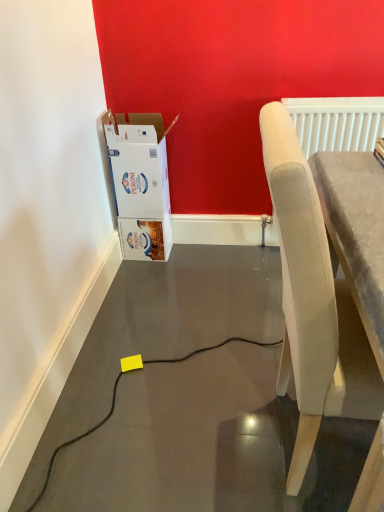
Describe the element at coordinates (313, 303) in the screenshot. I see `light gray fabric chair at right` at that location.

What do you see at coordinates (336, 123) in the screenshot? The height and width of the screenshot is (512, 384). I see `white textured radiator at upper right` at bounding box center [336, 123].

At what (x,y) coordinates should I click in order to perform the action: click on light gray fabric chair at right. Please return your answer as a coordinate pair (x, y). Looking at the image, I should click on (313, 303).

Considering the sizes of objects light gray fabric chair at right and white textured radiator at upper right in the image provided, who is bigger, light gray fabric chair at right or white textured radiator at upper right?

light gray fabric chair at right.

Identify the location of radiator above the light gray fabric chair at right (from the image's perspective). The image size is (384, 512). (336, 123).

Is light gray fabric chair at right at the left side of white textured radiator at upper right?

Yes.

What's the angular difference between light gray fabric chair at right and white textured radiator at upper right's facing directions?

There is a 90-degree angle between the facing directions of light gray fabric chair at right and white textured radiator at upper right.

Measure the distance from white cardboard box at left to white textured radiator at upper right.

white cardboard box at left and white textured radiator at upper right are 75.86 centimeters apart.

Is point (164, 159) closer to camera compared to point (340, 146)?

That is False.

From the image's perspective, who appears lower, white cardboard box at left or white textured radiator at upper right?

From the image's view, white cardboard box at left is below.

Who is shorter, white cardboard box at left or white textured radiator at upper right?

Standing shorter between the two is white textured radiator at upper right.

Which object is positioned more to the right, white textured radiator at upper right or light gray fabric chair at right?

Positioned to the right is white textured radiator at upper right.

The width and height of the screenshot is (384, 512). Find the location of `radiator above the light gray fabric chair at right (from the image's perspective)`. radiator above the light gray fabric chair at right (from the image's perspective) is located at coordinates (336, 123).

From a real-world perspective, is white textured radiator at upper right below light gray fabric chair at right?

No, from a real-world perspective, white textured radiator at upper right is not below light gray fabric chair at right.

Is white textured radiator at upper right looking in the opposite direction of light gray fabric chair at right?

No, white textured radiator at upper right is not facing the opposite direction of light gray fabric chair at right.

Is white cardboard box at left to the right of light gray fabric chair at right from the viewer's perspective?

No.

From a real-world perspective, which is physically below, white cardboard box at left or light gray fabric chair at right?

In real-world perspective, white cardboard box at left is lower.

Considering the relative positions of white cardboard box at left and light gray fabric chair at right in the image provided, is white cardboard box at left behind light gray fabric chair at right?

Yes, white cardboard box at left is further from the viewer.

The image size is (384, 512). Identify the location of chair lying below the white cardboard box at left (from the image's perspective). (313, 303).

In terms of width, does light gray fabric chair at right look wider or thinner when compared to white cardboard box at left?

Considering their sizes, light gray fabric chair at right looks broader than white cardboard box at left.

From a real-world perspective, which is physically above, light gray fabric chair at right or white cardboard box at left?

light gray fabric chair at right is physically above.

Can you confirm if light gray fabric chair at right is taller than white cardboard box at left?

Yes, light gray fabric chair at right is taller than white cardboard box at left.

Would you say light gray fabric chair at right contains white cardboard box at left?

No, white cardboard box at left is not a part of light gray fabric chair at right.

In terms of height, does white textured radiator at upper right look taller or shorter compared to white cardboard box at left?

In the image, white textured radiator at upper right appears to be shorter than white cardboard box at left.

Consider the image. Is white textured radiator at upper right with white cardboard box at left?

white textured radiator at upper right is not next to white cardboard box at left, and they're not touching.

Would you say white textured radiator at upper right is inside or outside white cardboard box at left?

white textured radiator at upper right cannot be found inside white cardboard box at left.

Does white textured radiator at upper right turn towards white cardboard box at left?

No.

Where is `chair in front of the white textured radiator at upper right`? The width and height of the screenshot is (384, 512). chair in front of the white textured radiator at upper right is located at coordinates (313, 303).

Image resolution: width=384 pixels, height=512 pixels. In order to click on radiator above the white cardboard box at left (from a real-world perspective) in this screenshot , I will do `click(336, 123)`.

Which object lies further to the anchor point white textured radiator at upper right, white cardboard box at left or light gray fabric chair at right?

light gray fabric chair at right is further to white textured radiator at upper right.

Looking at the image, which one is located further to white textured radiator at upper right, light gray fabric chair at right or white cardboard box at left?

The object further to white textured radiator at upper right is light gray fabric chair at right.

Considering their positions, is white cardboard box at left positioned further to light gray fabric chair at right than white textured radiator at upper right?

white cardboard box at left.

Looking at the image, which one is located further to white cardboard box at left, light gray fabric chair at right or white textured radiator at upper right?

light gray fabric chair at right lies further to white cardboard box at left than the other object.

From the image, which object appears to be farther from white cardboard box at left, white textured radiator at upper right or light gray fabric chair at right?

light gray fabric chair at right is further to white cardboard box at left.

When comparing their distances from light gray fabric chair at right, does white textured radiator at upper right or white cardboard box at left seem further?

white cardboard box at left is positioned further to the anchor light gray fabric chair at right.

I want to click on radiator between light gray fabric chair at right and white cardboard box at left from front to back, so 336,123.